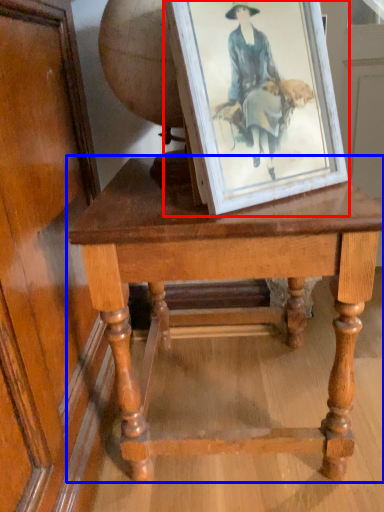
Question: Which of the following is the closest to the observer, picture frame (highlighted by a red box) or table (highlighted by a blue box)?

Choices:
 (A) picture frame
 (B) table

Answer: (A)